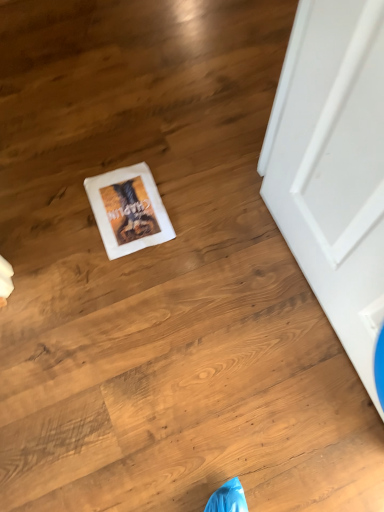
Find the location of a particular element. white paper postcard at center is located at coordinates (128, 210).

This screenshot has width=384, height=512. Describe the element at coordinates (128, 210) in the screenshot. I see `white paper postcard at center` at that location.

This screenshot has height=512, width=384. What do you see at coordinates (333, 166) in the screenshot?
I see `white matte door at right` at bounding box center [333, 166].

I want to click on white matte door at right, so click(x=333, y=166).

Locate an element on the screen. The height and width of the screenshot is (512, 384). white paper postcard at center is located at coordinates (128, 210).

Which is more to the right, white matte door at right or white paper postcard at center?

white matte door at right is more to the right.

Based on the photo, is white matte door at right positioned in front of white paper postcard at center?

Yes, white matte door at right is in front of white paper postcard at center.

Does point (320, 115) lie behind point (101, 214)?

No, (320, 115) is closer to viewer.

From the image's perspective, is white matte door at right on white paper postcard at center?

No, from the image's perspective, white matte door at right is not above white paper postcard at center.

From a real-world perspective, is white matte door at right below white paper postcard at center?

Actually, white matte door at right is physically above white paper postcard at center in the real world.

Considering the sizes of objects white matte door at right and white paper postcard at center in the image provided, who is wider, white matte door at right or white paper postcard at center?

Wider between the two is white paper postcard at center.

Considering the sizes of objects white matte door at right and white paper postcard at center in the image provided, who is shorter, white matte door at right or white paper postcard at center?

With less height is white paper postcard at center.

Between white matte door at right and white paper postcard at center, which one has smaller size?

With smaller size is white paper postcard at center.

Is white matte door at right inside the boundaries of white paper postcard at center, or outside?

white matte door at right cannot be found inside white paper postcard at center.

Is white matte door at right placed right next to white paper postcard at center?

→ No, white matte door at right is not with white paper postcard at center.

Is white matte door at right oriented towards white paper postcard at center?

Yes, white matte door at right is turned towards white paper postcard at center.

How many degrees apart are the facing directions of white matte door at right and white paper postcard at center?

88.8 degrees.

How far apart are white matte door at right and white paper postcard at center?

A distance of 19.46 inches exists between white matte door at right and white paper postcard at center.

In the image, there is a white matte door at right. In order to click on postcard above it (from the image's perspective) in this screenshot , I will do `click(128, 210)`.

Which is more to the left, white paper postcard at center or white matte door at right?

white paper postcard at center is more to the left.

Based on the photo, is white paper postcard at center in front of or behind white matte door at right in the image?

Clearly, white paper postcard at center is behind white matte door at right.

Does point (115, 211) lie behind point (290, 79)?

Yes, point (115, 211) is behind point (290, 79).

From the image's perspective, which one is positioned lower, white paper postcard at center or white matte door at right?

white matte door at right is shown below in the image.

From a real-world perspective, is white paper postcard at center physically located above or below white matte door at right?

white paper postcard at center is below white matte door at right.

Can you confirm if white paper postcard at center is wider than white matte door at right?

Yes.

Considering the sizes of objects white paper postcard at center and white matte door at right in the image provided, who is taller, white paper postcard at center or white matte door at right?

white matte door at right is taller.

Does white paper postcard at center have a smaller size compared to white matte door at right?

Correct, white paper postcard at center occupies less space than white matte door at right.

Would you say white paper postcard at center is inside or outside white matte door at right?

The correct answer is: outside.

Are white paper postcard at center and white matte door at right making contact?

No, white paper postcard at center is not with white matte door at right.

Could you tell me if white paper postcard at center is turned towards white matte door at right?

No.

Based on the photo, how many degrees apart are the facing directions of white paper postcard at center and white matte door at right?

88.8 degrees.

Measure the distance between white paper postcard at center and white matte door at right.

white paper postcard at center is 49.44 centimeters away from white matte door at right.

In the image, there is a white matte door at right. Where is `postcard below it (from a real-world perspective)`? postcard below it (from a real-world perspective) is located at coordinates pos(128,210).

Identify the location of postcard beneath the white matte door at right (from a real-world perspective). This screenshot has width=384, height=512. tap(128, 210).

The image size is (384, 512). I want to click on postcard that appears above the white matte door at right (from the image's perspective), so click(x=128, y=210).